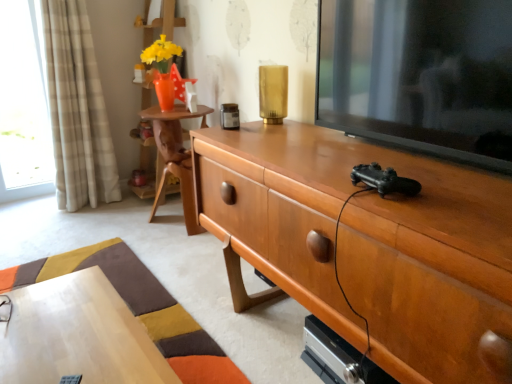
The height and width of the screenshot is (384, 512). I want to click on free space underneath beige plaid curtain at left (from a real-world perspective), so click(99, 203).